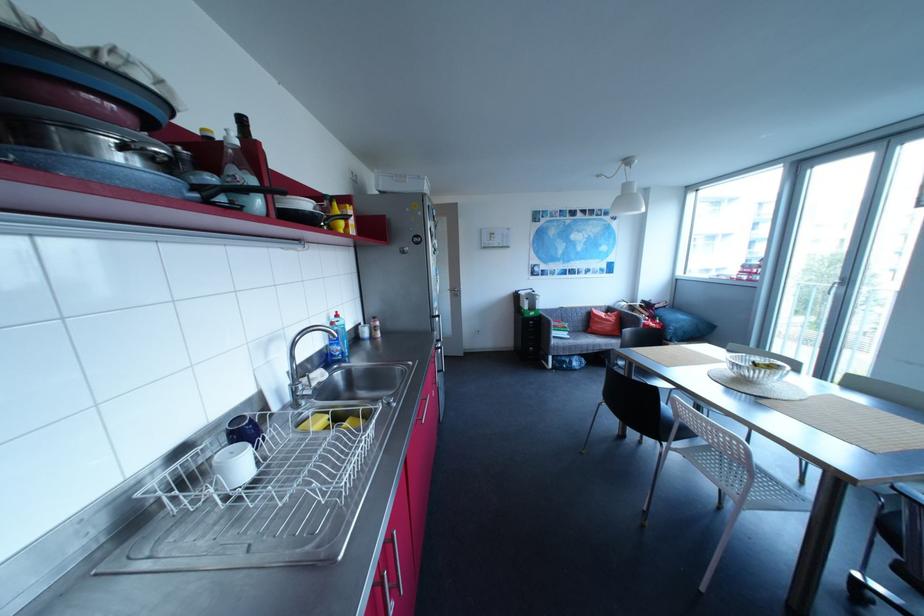
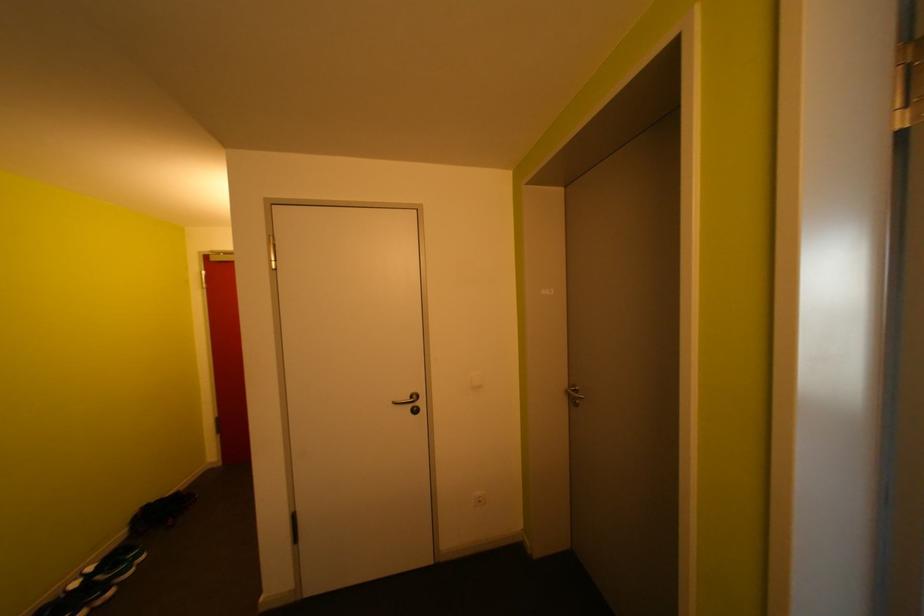
Which direction would the cameraman need to move to produce the second image?

The movement direction of the cameraman is left, forward.